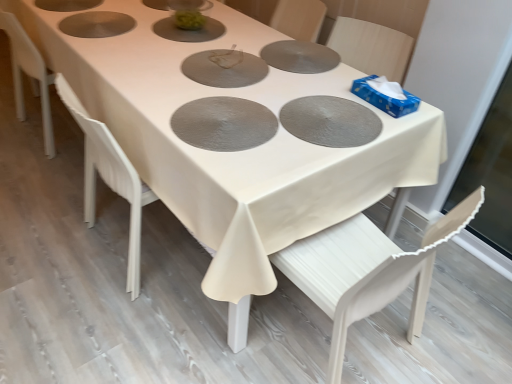
In order to click on free space in front of matte gray pizza pan at center, which ranks as the third pizza pan in bottom-to-top order in this screenshot , I will do `click(195, 90)`.